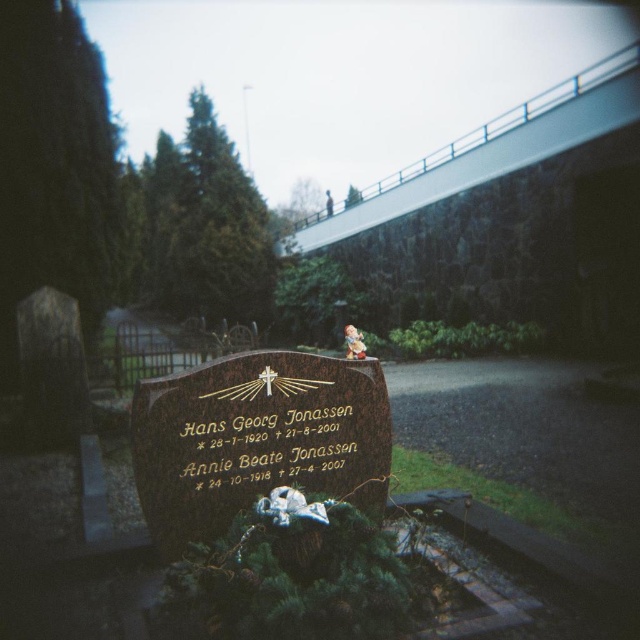
Question: Which object is farther from the camera taking this photo?

Choices:
 (A) matte stone inscription at center
 (B) brown polished stone gravestone at center

Answer: (A)

Question: Which object is closer to the camera taking this photo?

Choices:
 (A) white concrete overpass at upper center
 (B) matte ceramic figurine at center
 (C) brown polished stone gravestone at center

Answer: (C)

Question: Can you confirm if brown polished stone gravestone at center is smaller than white concrete overpass at upper center?

Choices:
 (A) no
 (B) yes

Answer: (B)

Question: Observing the image, what is the correct spatial positioning of matte stone inscription at center in reference to matte ceramic figurine at center?

Choices:
 (A) above
 (B) below

Answer: (B)

Question: Is brown polished stone gravestone at center smaller than white concrete overpass at upper center?

Choices:
 (A) no
 (B) yes

Answer: (B)

Question: Which object is farther from the camera taking this photo?

Choices:
 (A) brown polished stone gravestone at center
 (B) matte ceramic figurine at center

Answer: (B)